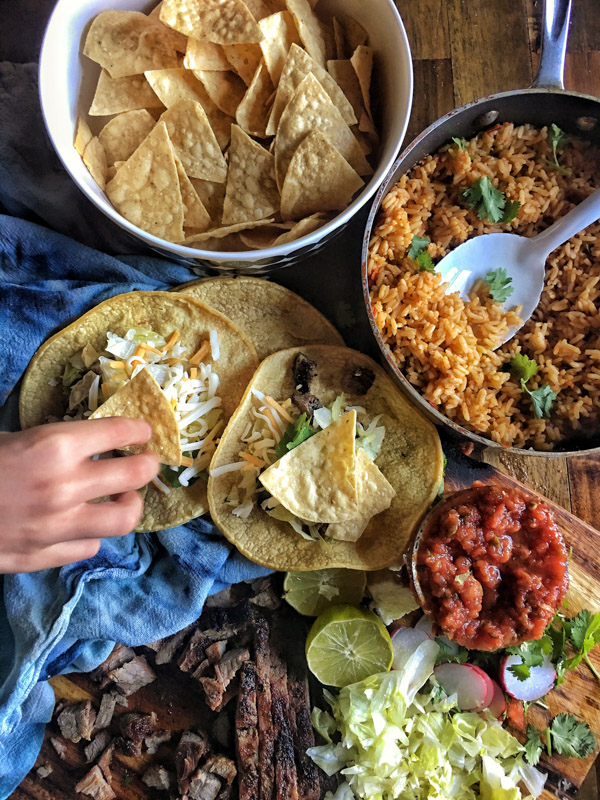
This screenshot has height=800, width=600. Identify the location of spoon. (521, 242).